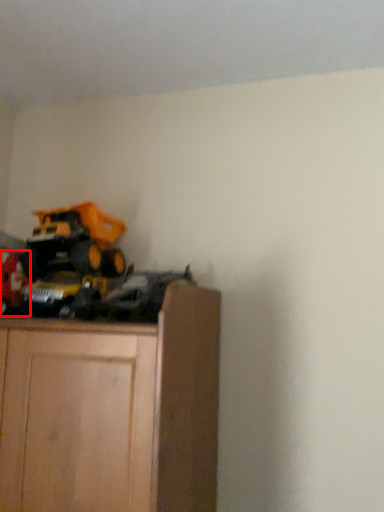
Question: From the image's perspective, what is the correct spatial positioning of toy (annotated by the red box) in reference to equipment?

Choices:
 (A) below
 (B) above

Answer: (A)